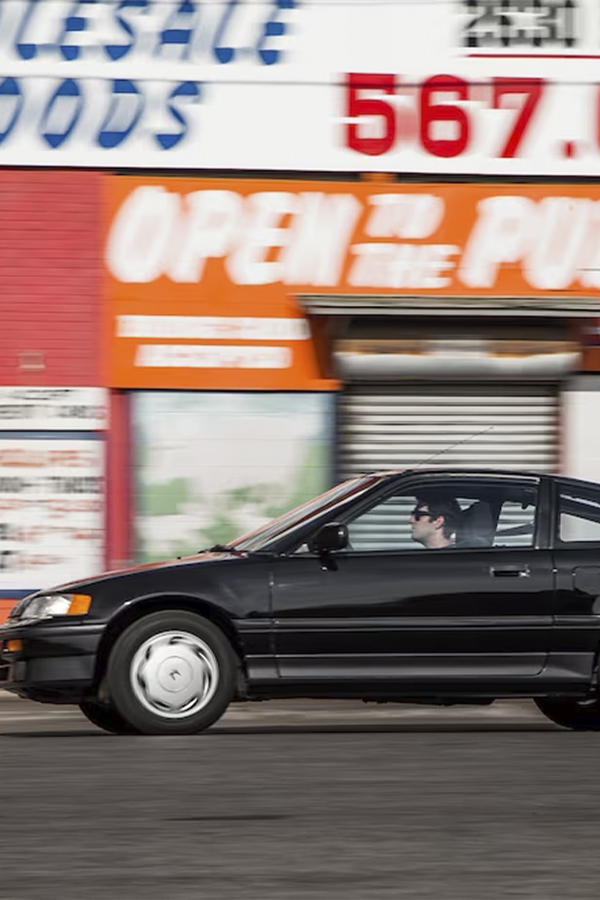
Identify the location of light. (52, 606), (75, 608).